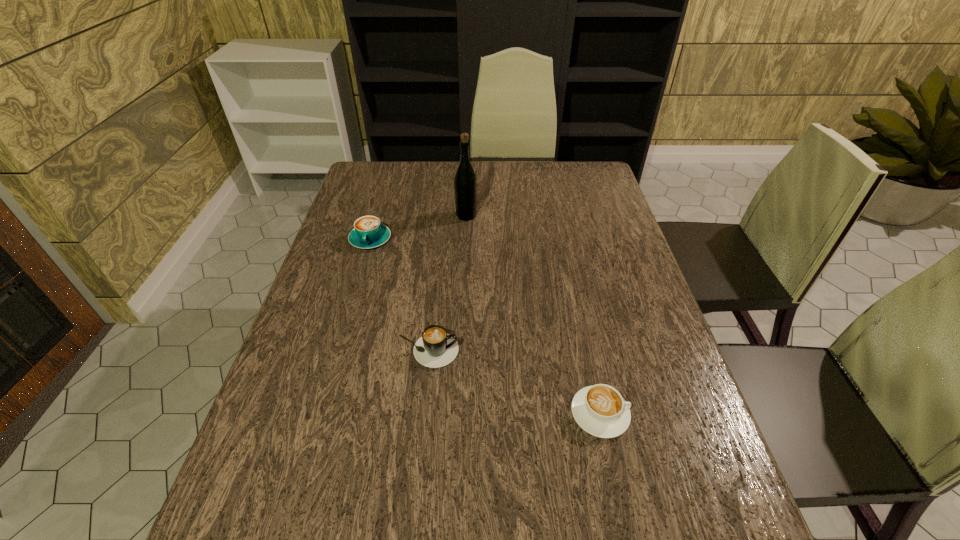
Find the location of `beer bottle`. beer bottle is located at coordinates (465, 183).

Where is `the tallest object`? the tallest object is located at coordinates (465, 183).

I want to click on the third farthest object, so click(436, 348).

I want to click on the second cappuccino from right to left, so click(x=436, y=348).

At what (x,y) coordinates should I click in order to perform the action: click on the farthest cappuccino. Please return your answer as a coordinate pair (x, y). The image size is (960, 540). Looking at the image, I should click on (368, 232).

Where is `the second farthest object`? the second farthest object is located at coordinates (368, 232).

The image size is (960, 540). Identify the location of the shortest cappuccino. (600, 410).

This screenshot has height=540, width=960. I want to click on the rightmost cappuccino, so click(x=600, y=410).

Where is `vacant space located 0.270m on the front of the tallest object`? vacant space located 0.270m on the front of the tallest object is located at coordinates (464, 282).

In order to click on blank area located with the handle on the side of the second nearest cappuccino in this screenshot , I will do `click(493, 351)`.